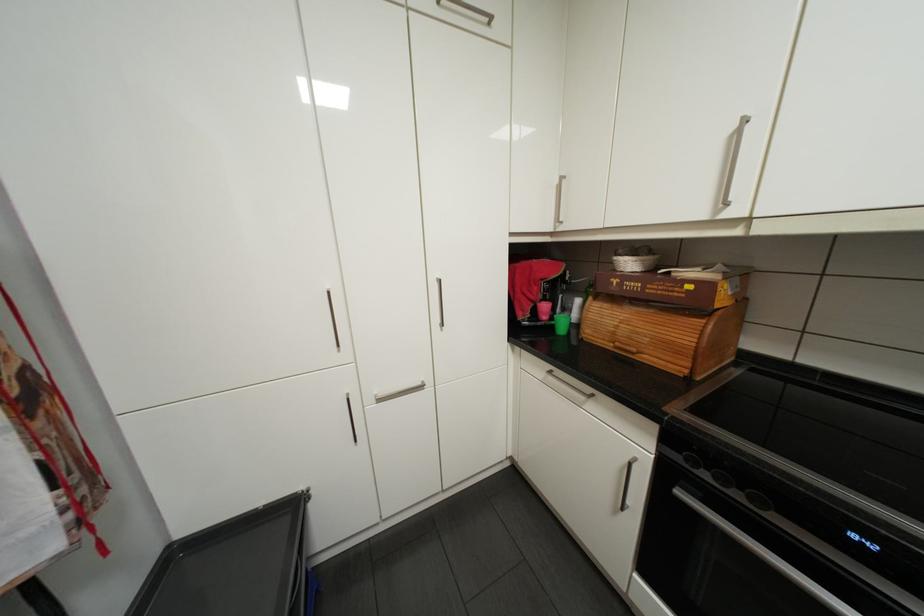
The width and height of the screenshot is (924, 616). I want to click on oven door handle, so click(x=767, y=556).